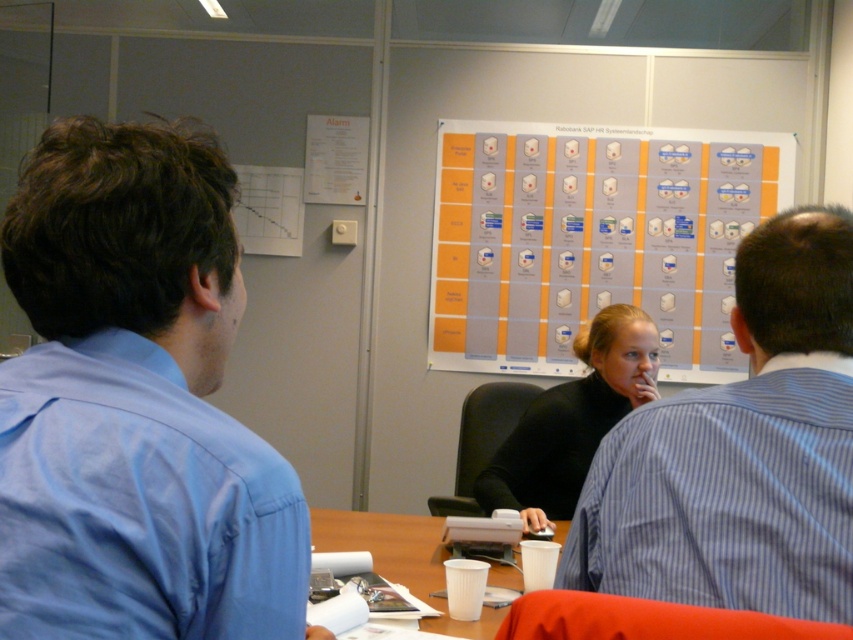
Is black matte turtleneck at center closer to camera compared to white paper at upper left?

Yes.

Does black matte turtleneck at center have a lesser height compared to white paper at upper left?

No, black matte turtleneck at center is not shorter than white paper at upper left.

Is point (633, 326) in front of point (312, 124)?

Yes.

This screenshot has height=640, width=853. I want to click on black matte turtleneck at center, so click(572, 420).

The height and width of the screenshot is (640, 853). Find the location of `blue striped shirt at upper right`. blue striped shirt at upper right is located at coordinates (741, 451).

Between point (846, 330) and point (392, 518), which one is positioned behind?

The point (392, 518) is behind.

This screenshot has width=853, height=640. In order to click on blue striped shirt at upper right in this screenshot , I will do `click(741, 451)`.

Does point (749, 208) lie behind point (363, 138)?

No, it is in front of (363, 138).

Is orange matte poster at center below white paper at upper left?

Indeed, orange matte poster at center is positioned under white paper at upper left.

This screenshot has height=640, width=853. Describe the element at coordinates (592, 240) in the screenshot. I see `orange matte poster at center` at that location.

The height and width of the screenshot is (640, 853). In order to click on orange matte poster at center in this screenshot , I will do `click(592, 240)`.